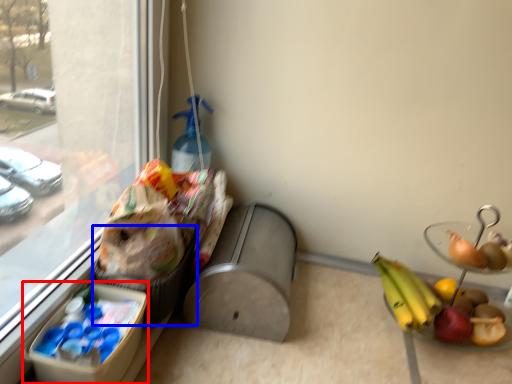
Question: Which point is further to the camera, lunch box (highlighted by a red box) or basket (highlighted by a blue box)?

Choices:
 (A) lunch box
 (B) basket

Answer: (B)